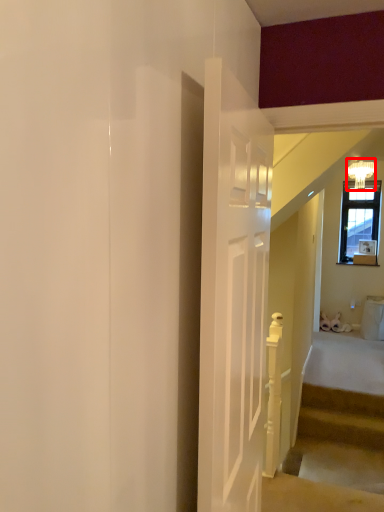
Question: From the image's perspective, where is light fixture (annotated by the red box) located in relation to stairs in the image?

Choices:
 (A) below
 (B) above

Answer: (B)